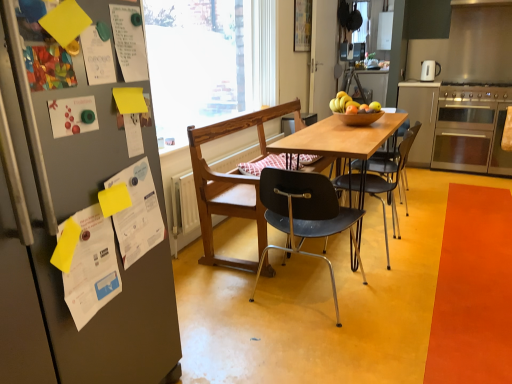
I want to click on unoccupied region to the right of black plastic chair at center, which appears as the 1th chair when viewed from the back, so click(x=432, y=244).